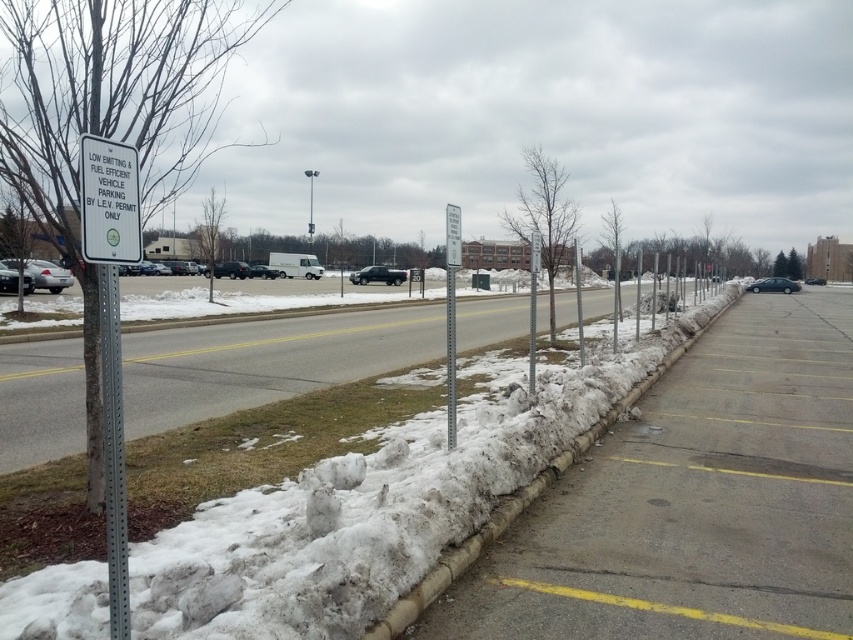
You are standing at the entrance of the parking lot and want to walk to the white fluffy snow at center. Which direction should you head?

The white fluffy snow at center is located at point (375, 508), so you should head towards the center of the parking lot.

You need to park your car in the parking lot shown. The parking lot has a white fluffy snow at center and a silver metallic sedan at left. According to the sign, only low emitting and fuel efficient vehicles are allowed here. Is your car eligible to park here if it is a fuel efficient vehicle?

The white fluffy snow at center is located below silver metallic sedan at left, but this spatial information does not affect parking eligibility. Since your car is a fuel efficient vehicle, it meets the requirement stated on the sign for parking in this area.